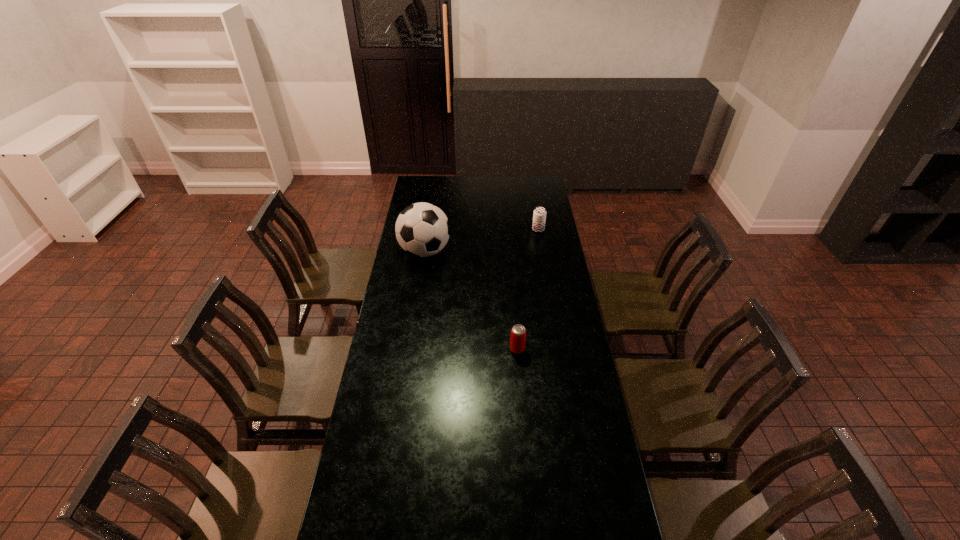
Find the location of a particular element. the tallest object is located at coordinates (422, 229).

You are a GUI agent. You are given a task and a screenshot of the screen. Output one action in this format:
    pyautogui.click(x=<x>, y=<y>)
    Task: Click on the leftmost object
    The image size is (960, 540).
    Given the screenshot: What is the action you would take?
    pyautogui.click(x=422, y=229)

You are a GUI agent. You are given a task and a screenshot of the screen. Output one action in this format:
    pyautogui.click(x=<x>, y=<y>)
    Task: Click on the right beer can
    
    Given the screenshot: What is the action you would take?
    pyautogui.click(x=539, y=216)

Where is `the farthest object`? This screenshot has width=960, height=540. the farthest object is located at coordinates (539, 216).

The width and height of the screenshot is (960, 540). Find the location of `the second object from left to right`. the second object from left to right is located at coordinates coord(518,333).

Where is `the nearest object`? the nearest object is located at coordinates (518, 333).

Image resolution: width=960 pixels, height=540 pixels. What are the coordinates of `vacant position located on the front of the leftmost object` in the screenshot? It's located at (418, 300).

The height and width of the screenshot is (540, 960). I want to click on vacant space situated 0.390m on the left of the farther beer can, so click(x=461, y=230).

At what (x,y) coordinates should I click in order to perform the action: click on vacant space located on the left of the left beer can. Please return your answer as a coordinate pair (x, y). Image resolution: width=960 pixels, height=540 pixels. Looking at the image, I should click on (433, 349).

Find the location of a particular element. object located at the left edge is located at coordinates (422, 229).